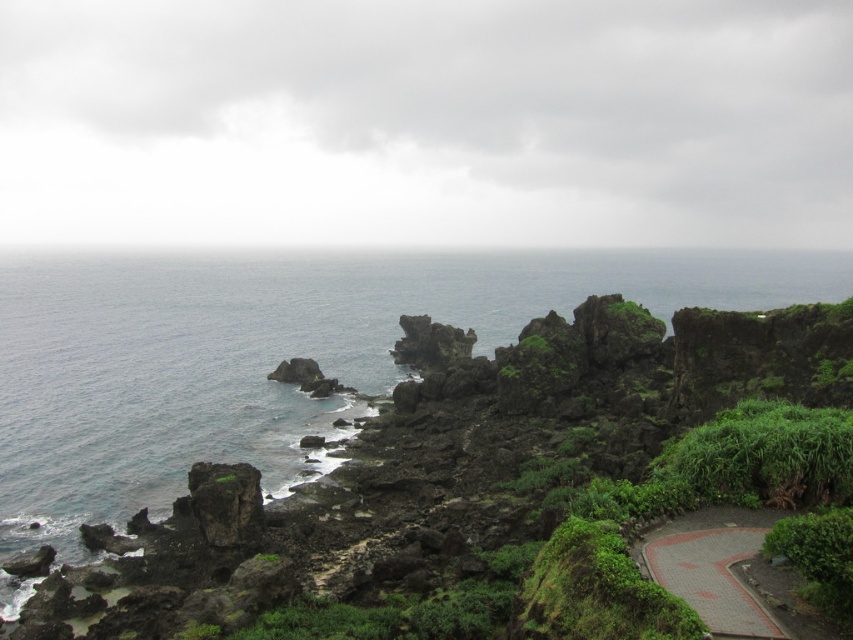
You are standing on the pathway marked with red and white lines on the right side of the image. You want to reach the blue water at center. Which direction should you walk to get there?

The blue water at center is located at coordinates approximately 0.553 on the x axis and 0.319 on the y axis. Since you are on the pathway on the right side, you should walk towards the left to reach the blue water at center.